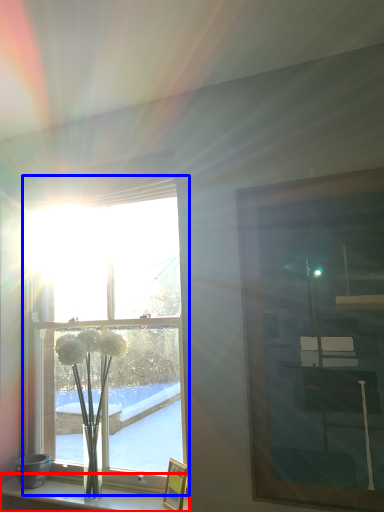
Question: Among these objects, which one is farthest to the camera, shelf (highlighted by a red box) or window (highlighted by a blue box)?

Choices:
 (A) shelf
 (B) window

Answer: (B)